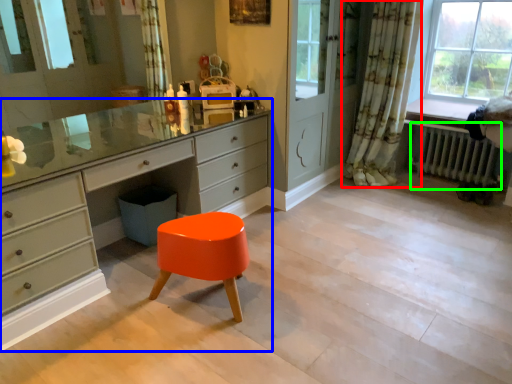
Question: Which object is positioned closest to curtain (highlighted by a red box)? Select from chest of drawers (highlighted by a blue box) and radiator (highlighted by a green box).

Choices:
 (A) chest of drawers
 (B) radiator

Answer: (B)